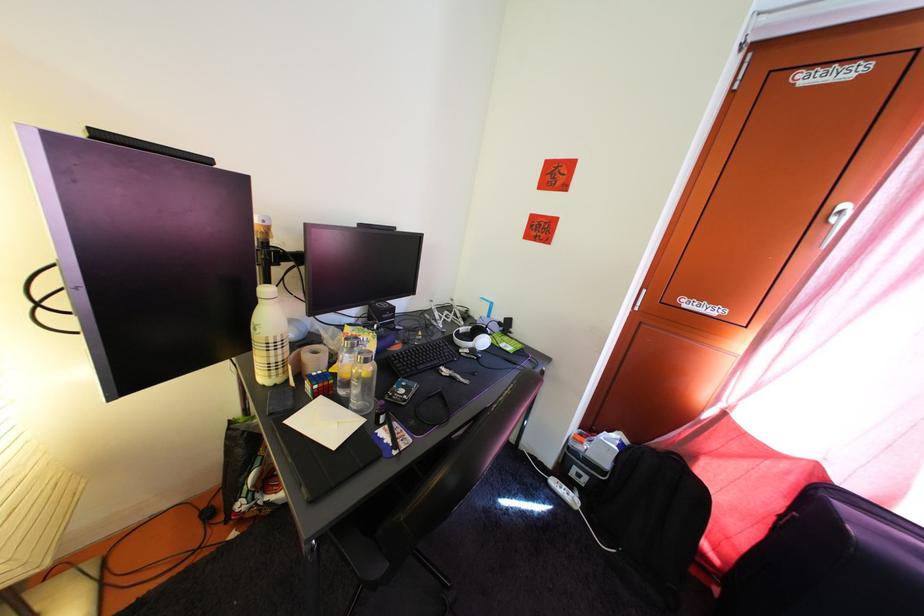
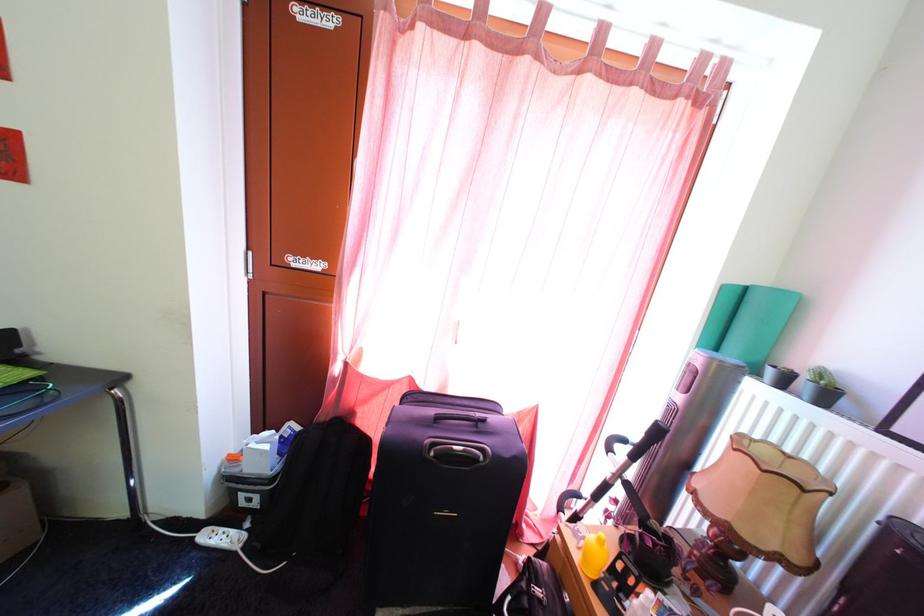
Where in the second image is the point corresponding to point 557,480 from the first image?

(208, 533)